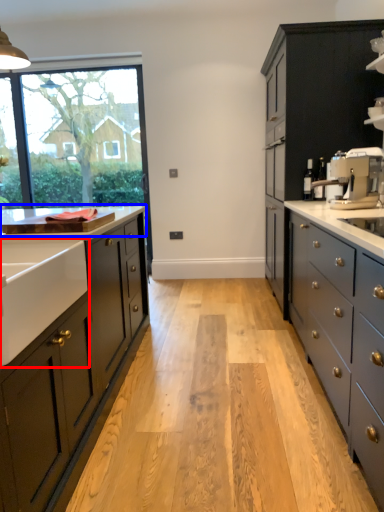
Question: Which object is further to the camera taking this photo, sink (highlighted by a red box) or countertop (highlighted by a blue box)?

Choices:
 (A) sink
 (B) countertop

Answer: (B)